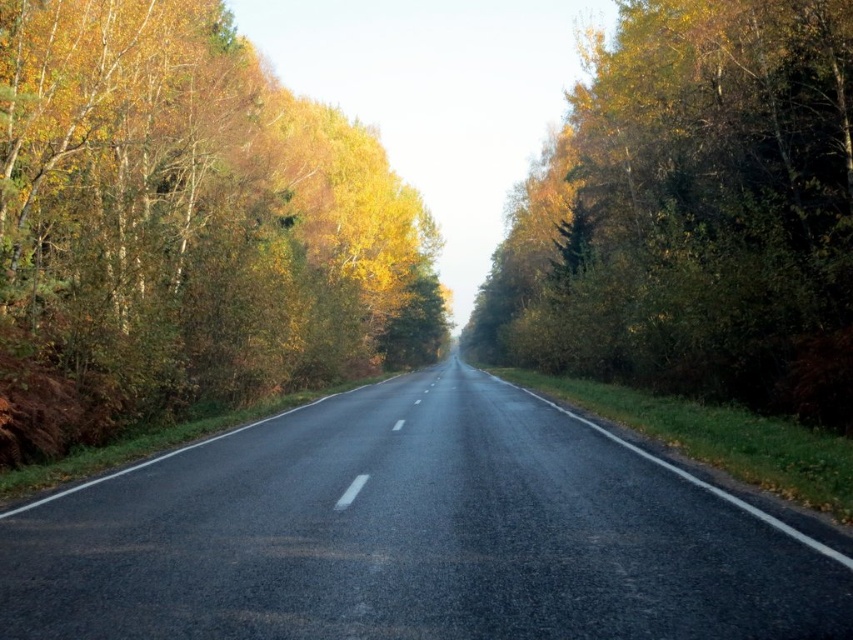
Can you confirm if yellow-green leaves at left is positioned to the right of green leafy tree at right?

No, yellow-green leaves at left is not to the right of green leafy tree at right.

Does yellow-green leaves at left have a greater width compared to green leafy tree at right?

Correct, the width of yellow-green leaves at left exceeds that of green leafy tree at right.

This screenshot has width=853, height=640. What do you see at coordinates (177, 224) in the screenshot?
I see `yellow-green leaves at left` at bounding box center [177, 224].

The image size is (853, 640). I want to click on yellow-green leaves at left, so click(x=177, y=224).

Does point (612, 580) lie in front of point (830, 289)?

Yes, it is.

Which of these two, black asphalt highway at center or green leafy tree at right, stands taller?

Standing taller between the two is green leafy tree at right.

This screenshot has width=853, height=640. What are the coordinates of `black asphalt highway at center` in the screenshot? It's located at coord(416,534).

Does point (601, 592) come in front of point (173, 140)?

Yes, point (601, 592) is closer to viewer.

Between black asphalt highway at center and yellow-green leaves at left, which one is positioned higher?

yellow-green leaves at left

Locate an element on the screen. This screenshot has height=640, width=853. black asphalt highway at center is located at coordinates (416, 534).

You are a GUI agent. You are given a task and a screenshot of the screen. Output one action in this format:
    pyautogui.click(x=<x>, y=<y>)
    Task: Click on the black asphalt highway at center
    The width and height of the screenshot is (853, 640).
    Given the screenshot: What is the action you would take?
    pyautogui.click(x=416, y=534)